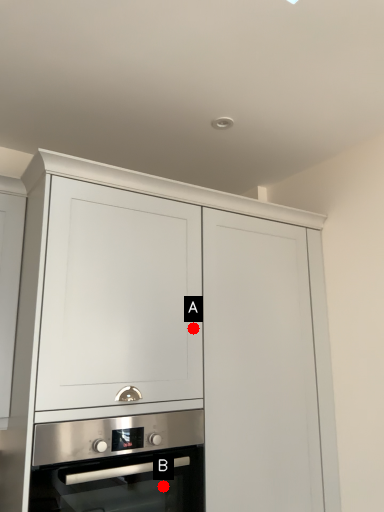
Question: Two points are circled on the image, labeled by A and B beside each circle. Which point appears farthest from the camera in this image?

Choices:
 (A) A is further
 (B) B is further

Answer: (A)